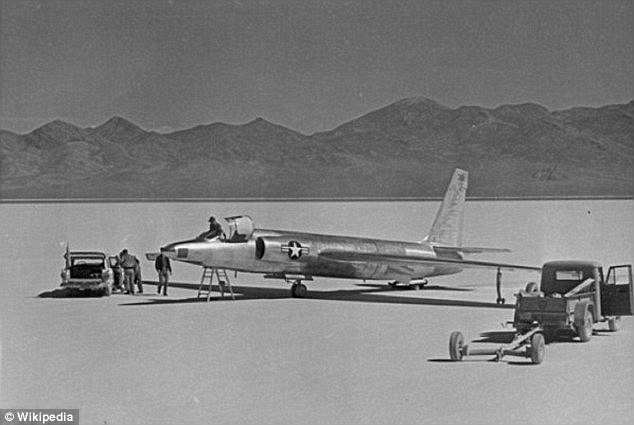
Locate an element on the screen. door is located at coordinates (617, 288).